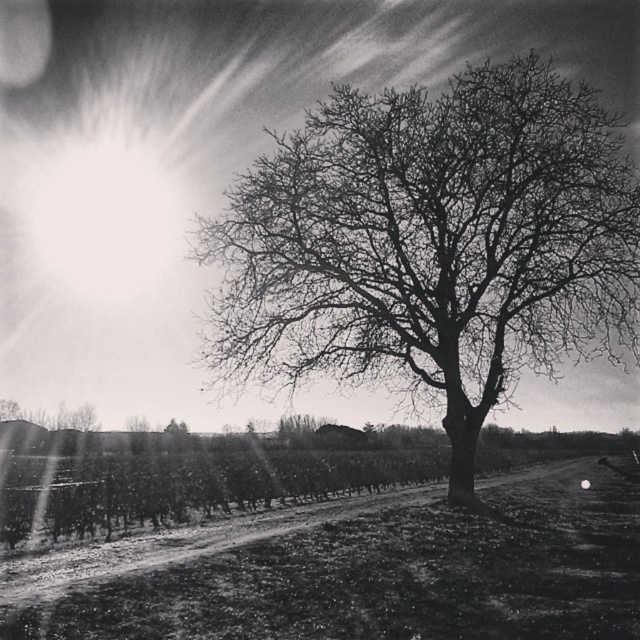
You are an artist sketching this scene. You need to place the bare branches at center in your drawing. According to the coordinates given, where should you position them on your canvas?

The bare branches at center should be positioned at coordinates point (433, 244) on the canvas.

You are an artist trying to sketch this scene. You notice the bare branches at center and the dirt ground at center. Which of these two elements should you draw with a thinner line to maintain the scene proportions?

The bare branches at center has a lesser width compared to dirt ground at center, so you should draw the bare branches at center with a thinner line to maintain the scene proportions.